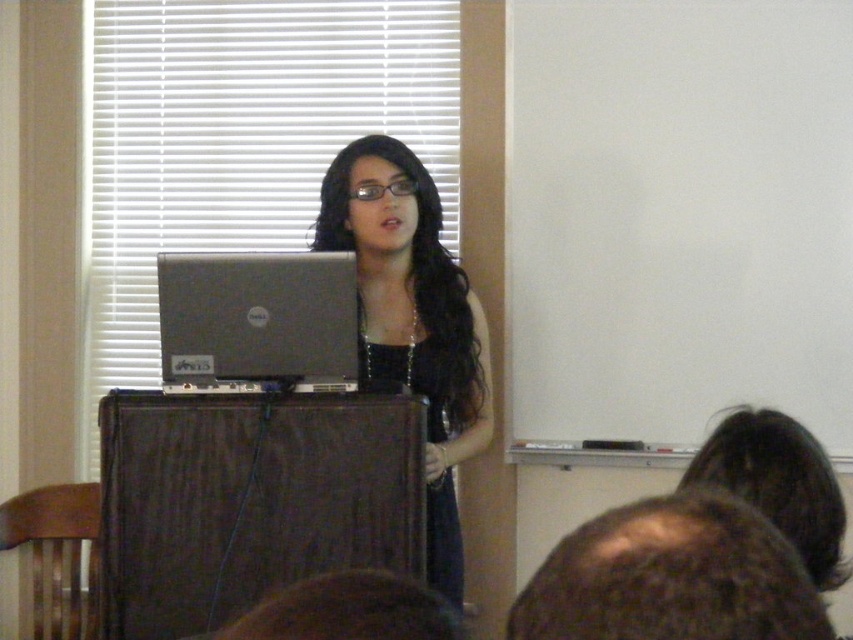
Question: Which point appears farthest from the camera in this image?

Choices:
 (A) (701, 547)
 (B) (163, 360)

Answer: (B)

Question: From the image, what is the correct spatial relationship of matte black dress at center in relation to silver metallic laptop at center?

Choices:
 (A) right
 (B) left

Answer: (A)

Question: Among these objects, which one is farthest from the camera?

Choices:
 (A) matte black dress at center
 (B) silver metallic laptop at center

Answer: (A)

Question: Which object is positioned farthest from the matte black dress at center?

Choices:
 (A) brown fuzzy hair at lower right
 (B) silver metallic laptop at center

Answer: (A)

Question: Is brown fuzzy hair at lower right further to the viewer compared to silver metallic laptop at center?

Choices:
 (A) no
 (B) yes

Answer: (A)

Question: Can you confirm if matte black dress at center is positioned above brown fuzzy hair at lower right?

Choices:
 (A) yes
 (B) no

Answer: (A)